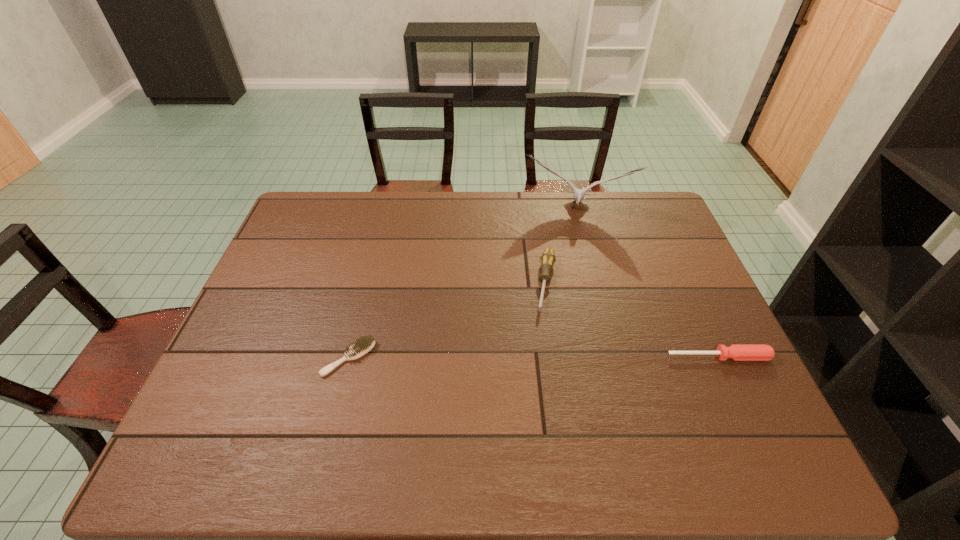
This screenshot has width=960, height=540. In order to click on free space between the gull and the farther screwdriver in this screenshot , I will do `click(561, 247)`.

Find the location of a particular element. This screenshot has height=540, width=960. vacant space that's between the nearer screwdriver and the third nearest object is located at coordinates pos(633,320).

I want to click on vacant point located between the gull and the taller screwdriver, so click(x=561, y=247).

Identify the location of free space that is in between the shorter screwdriver and the farthest object. The image size is (960, 540). (647, 284).

Locate an element on the screen. The height and width of the screenshot is (540, 960). free space that is in between the tallest object and the leftmost object is located at coordinates (462, 284).

I want to click on vacant area that lies between the gull and the nearer screwdriver, so click(647, 284).

The height and width of the screenshot is (540, 960). I want to click on the third closest object relative to the third tallest object, so click(x=363, y=345).

Image resolution: width=960 pixels, height=540 pixels. Identify the location of object that ranks as the third closest to the farther screwdriver. (363, 345).

Identify the location of free spot that satisfies the following two spatial constraints: 1. on the back side of the farther screwdriver; 2. on the right side of the tallest object. This screenshot has width=960, height=540. (535, 210).